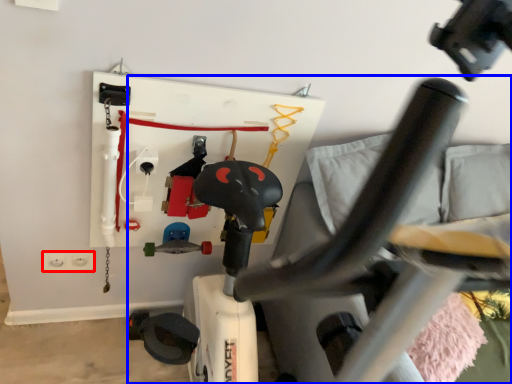
Question: Which object appears farthest to the camera in this image, electric outlet (highlighted by a red box) or swivel chair (highlighted by a blue box)?

Choices:
 (A) electric outlet
 (B) swivel chair

Answer: (A)